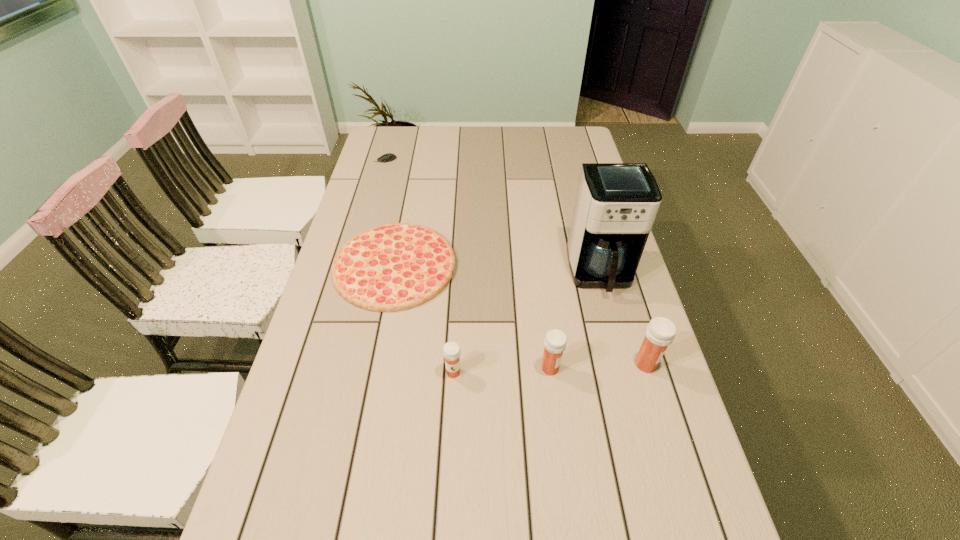
At what (x,y) coordinates should I click in order to perform the action: click on free space at the left edge. Please return your answer as a coordinate pair (x, y). Looking at the image, I should click on (396, 170).

The height and width of the screenshot is (540, 960). I want to click on vacant point at the right edge, so click(686, 475).

Locate an element on the screen. Image resolution: width=960 pixels, height=540 pixels. vacant space at the far left corner is located at coordinates (396, 150).

In the image, there is a desktop. Identify the location of vacant space at the far right corner. This screenshot has width=960, height=540. (573, 145).

The width and height of the screenshot is (960, 540). I want to click on vacant region at the near right corner of the desktop, so click(x=665, y=511).

Identify the location of unoccupied area between the shortest medicine and the pizza. (424, 319).

Identify the location of free spot between the coffee maker and the fourth tallest object. (527, 322).

Where is `vacant area that lies between the fifth shortest object and the coffee maker`? vacant area that lies between the fifth shortest object and the coffee maker is located at coordinates (623, 319).

Image resolution: width=960 pixels, height=540 pixels. Find the location of `empty space between the computer mouse and the fourth shortest object`. empty space between the computer mouse and the fourth shortest object is located at coordinates (468, 264).

At what (x,y) coordinates should I click in order to perform the action: click on vacant area that lies between the third object from right to left and the rightmost medicine. Please return your answer as a coordinate pair (x, y). Image resolution: width=960 pixels, height=540 pixels. Looking at the image, I should click on (598, 366).